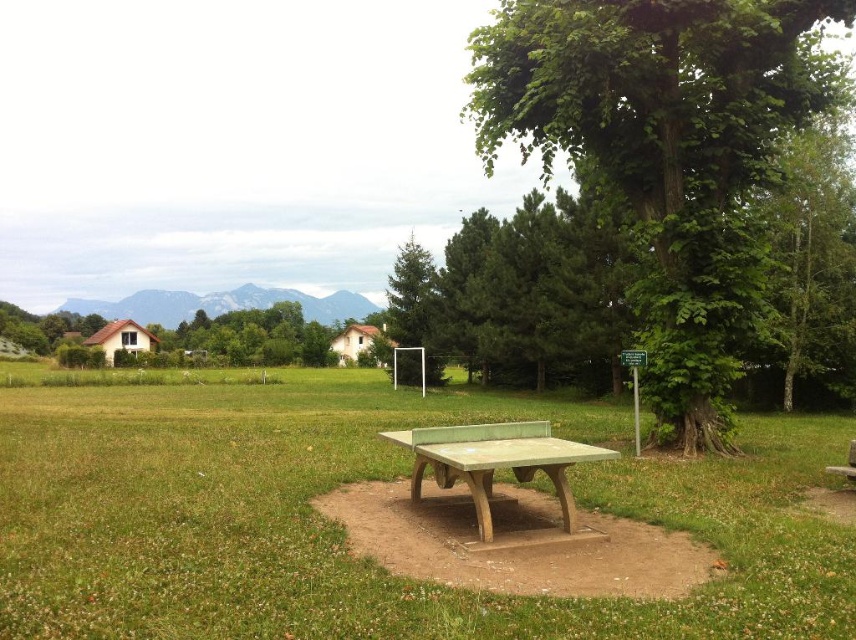
Can you confirm if green leafy tree at upper left is positioned above wooden park bench at lower right?

Yes, green leafy tree at upper left is above wooden park bench at lower right.

Measure the distance between green leafy tree at upper left and wooden park bench at lower right.

green leafy tree at upper left and wooden park bench at lower right are 108.28 meters apart.

Is point (52, 314) positioned in front of point (854, 474)?

No, it is behind (854, 474).

Locate an element on the screen. This screenshot has height=640, width=856. green leafy tree at upper left is located at coordinates (45, 326).

Can you confirm if green matte tree at center is taller than green leafy tree at upper left?

Yes.

Is green matte tree at center positioned behind green leafy tree at upper left?

No.

Is point (403, 257) in front of point (60, 314)?

That is True.

I want to click on green matte tree at center, so click(x=414, y=314).

What do you see at coordinates (253, 337) in the screenshot?
I see `green leafy tree at center` at bounding box center [253, 337].

Is green leafy tree at center shorter than green matte tree at center?

Correct, green leafy tree at center is not as tall as green matte tree at center.

What do you see at coordinates (253, 337) in the screenshot? This screenshot has width=856, height=640. I see `green leafy tree at center` at bounding box center [253, 337].

Find the location of a particular element. green leafy tree at center is located at coordinates (253, 337).